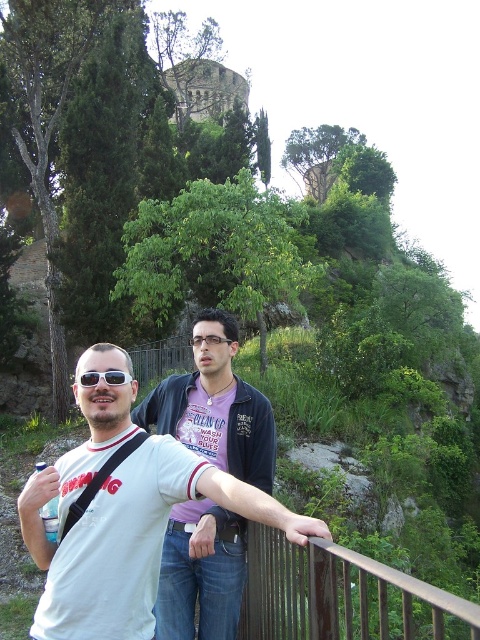
Does point (232, 349) lie in front of point (86, 378)?

No, (232, 349) is further to viewer.

Locate an element on the screen. This screenshot has height=640, width=480. purple cotton shirt at center is located at coordinates (216, 406).

Image resolution: width=480 pixels, height=640 pixels. Find the location of `purple cotton shirt at center`. purple cotton shirt at center is located at coordinates (216, 406).

Is white matte t-shirt at center smaller than purple cotton shirt at center?

Correct, white matte t-shirt at center occupies less space than purple cotton shirt at center.

Can you confirm if white matte t-shirt at center is bigger than purple cotton shirt at center?

Incorrect, white matte t-shirt at center is not larger than purple cotton shirt at center.

The height and width of the screenshot is (640, 480). I want to click on white matte t-shirt at center, so click(122, 515).

Can you confirm if white matte t-shirt at center is positioned above rusty metal rail at lower center?

Yes.

Where is `white matte t-shirt at center`? white matte t-shirt at center is located at coordinates (122, 515).